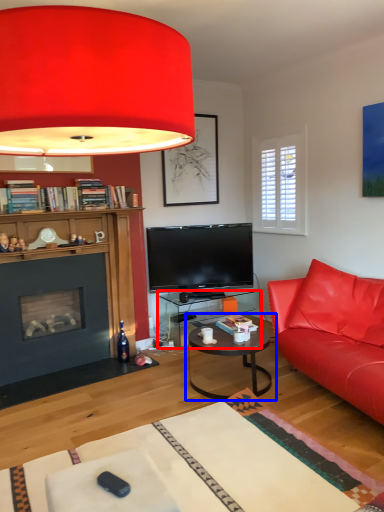
Question: Among these objects, which one is nearest to the camera, desk (highlighted by a red box) or coffee table (highlighted by a blue box)?

Choices:
 (A) desk
 (B) coffee table

Answer: (B)